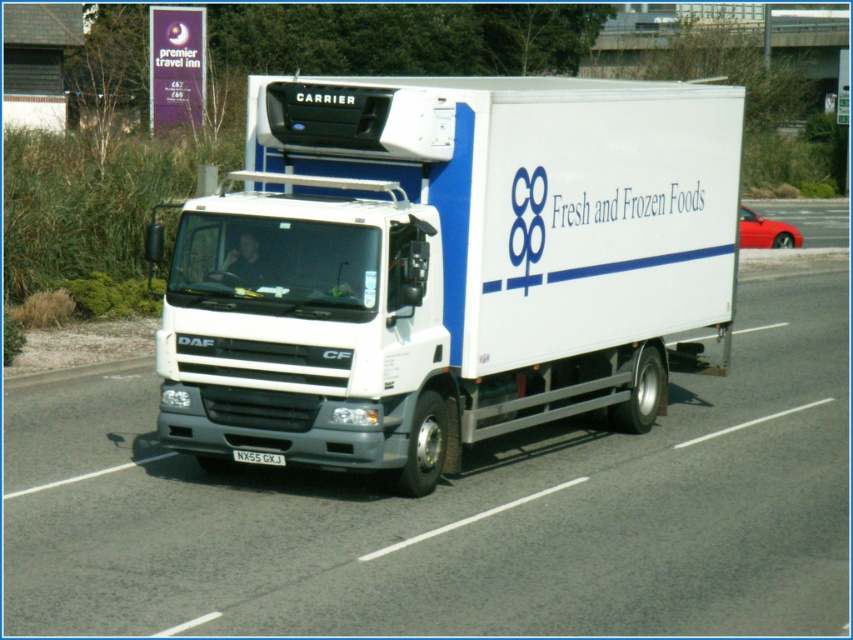
Does white glossy truck at center appear on the right side of black plastic license plate at center?

Correct, you'll find white glossy truck at center to the right of black plastic license plate at center.

Can you confirm if white glossy truck at center is wider than black plastic license plate at center?

Correct, the width of white glossy truck at center exceeds that of black plastic license plate at center.

Between point (734, 502) and point (238, 454), which one is positioned in front?

Positioned in front is point (238, 454).

This screenshot has width=853, height=640. I want to click on white glossy truck at center, so click(457, 513).

In the scene shown: Which is below, white matte truck at center or black plastic license plate at center?

black plastic license plate at center is lower down.

Is point (258, 355) positioned after point (281, 461)?

No, it is in front of (281, 461).

Find the location of `white matte truck at center`. white matte truck at center is located at coordinates (447, 266).

Can you confirm if white matte truck at center is shorter than white glossy truck at center?

Incorrect, white matte truck at center's height does not fall short of white glossy truck at center's.

This screenshot has width=853, height=640. I want to click on white matte truck at center, so click(x=447, y=266).